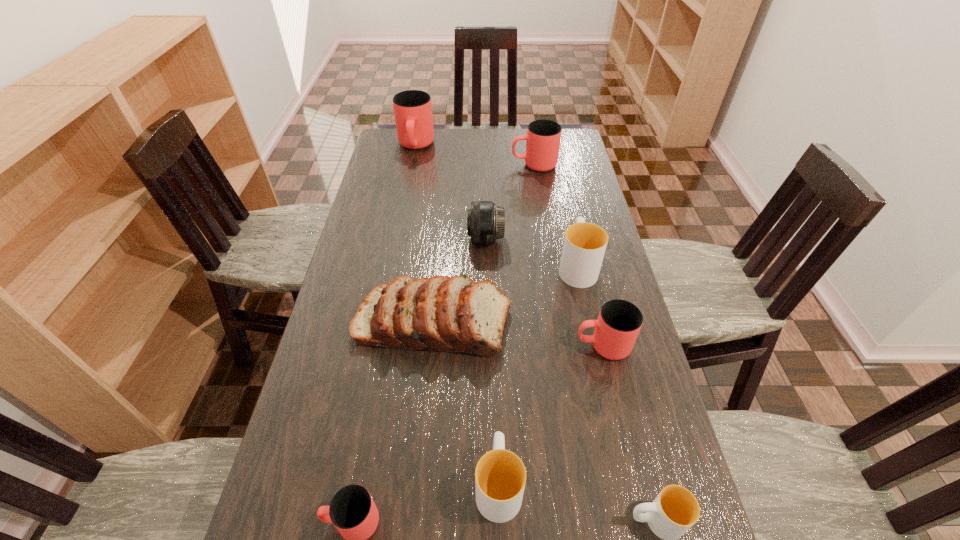
Identify which object is the eighth closest to the biggest pink cup. Please provide its 2D coordinates. Your answer should be formatted as a tuple, i.e. [(x, y)], where the tuple contains the x and y coordinates of a point satisfying the conditions above.

[(675, 509)]

Image resolution: width=960 pixels, height=540 pixels. I want to click on object that can be found as the closest to the farthest yellow cup, so click(453, 314).

This screenshot has width=960, height=540. I want to click on cup identified as the fifth closest to the nearest pink cup, so click(x=543, y=136).

At what (x,y) coordinates should I click in order to perform the action: click on cup that is the fifth closest to the nearest pink cup. Please return your answer as a coordinate pair (x, y). This screenshot has height=540, width=960. Looking at the image, I should click on (543, 136).

Locate an element on the screen. The width and height of the screenshot is (960, 540). the second closest pink cup to the smallest pink cup is located at coordinates (543, 136).

What are the coordinates of `the third closest pink cup to the second nearest pink cup` in the screenshot? It's located at (413, 110).

Choose which yellow cup is the third nearest neighbor to the bread. Please provide its 2D coordinates. Your answer should be formatted as a tuple, i.e. [(x, y)], where the tuple contains the x and y coordinates of a point satisfying the conditions above.

[(675, 509)]

Where is `yellow cup that is the second closest one to the farthest yellow cup`? yellow cup that is the second closest one to the farthest yellow cup is located at coordinates (675, 509).

Find the location of a particular element. This screenshot has height=540, width=960. free location that satisfies the following two spatial constraints: 1. on the handle side of the tallest object; 2. on the handle side of the third smallest pink cup is located at coordinates (412, 165).

Identify the location of free space that satisfies the following two spatial constraints: 1. with the handle on the side of the second smallest yellow cup; 2. on the handle side of the second biggest pink cup. (490, 165).